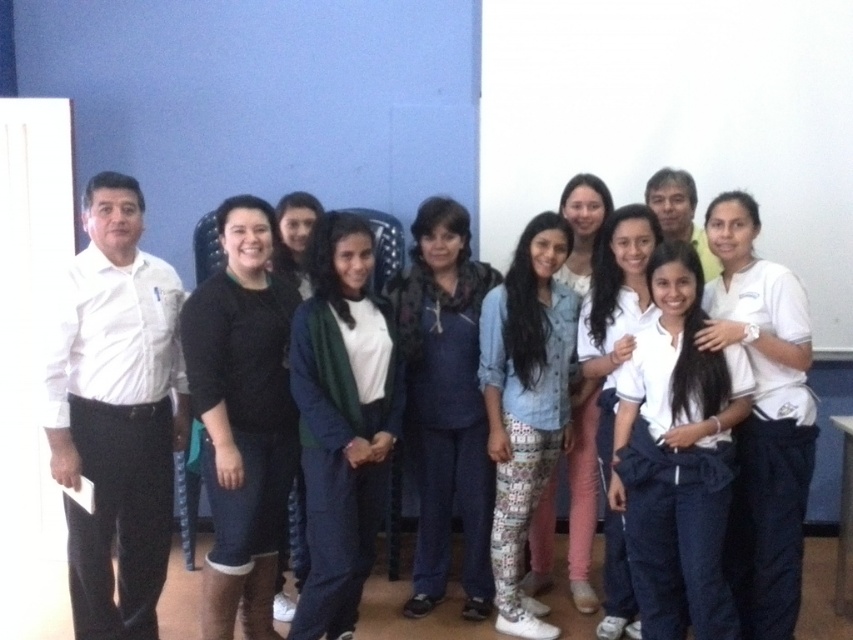
You are a photographer trying to adjust the lighting for a group photo. You notice the black matte sweater at center and the dark blue denim pants at center. Which clothing item is located to the left of the other?

The black matte sweater at center is positioned on the left side of dark blue denim pants at center.

You are a photographer adjusting your camera settings to focus on the black matte sweater at center and the dark blue denim pants at center. Which object should you focus on first to ensure both are in sharp focus?

The black matte sweater at center is closer to the viewer than the dark blue denim pants at center, so focus on the black matte sweater at center first to ensure both are in sharp focus.